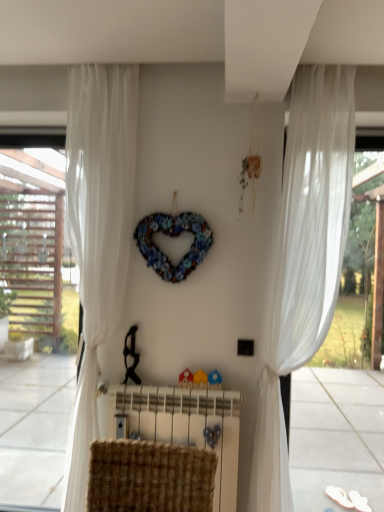
What are the coordinates of `free space above white sheer curtain at right, the first curtain when ordered from right to left (from a real-world perspective)` in the screenshot? It's located at (316, 68).